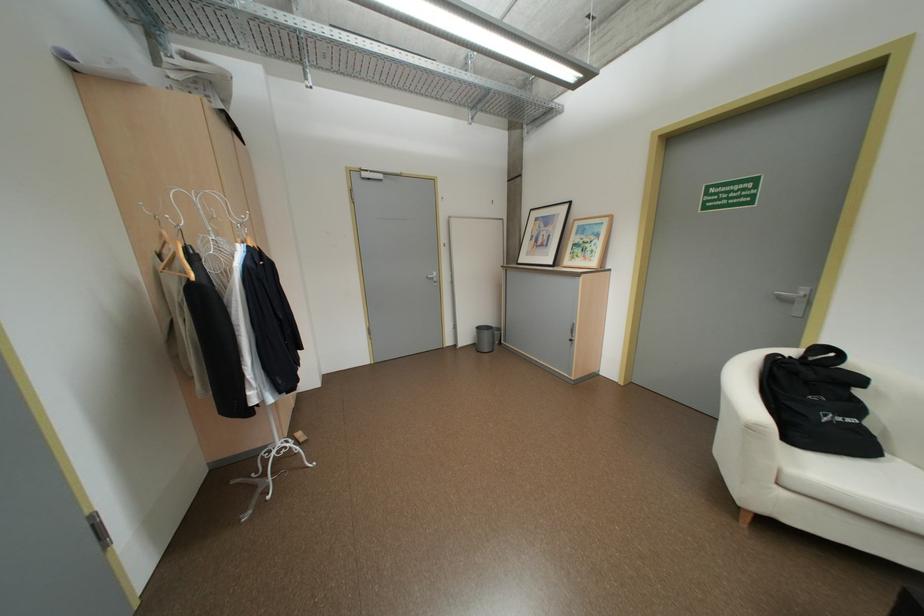
Describe the element at coordinates (205, 223) in the screenshot. I see `the white coat rack hook` at that location.